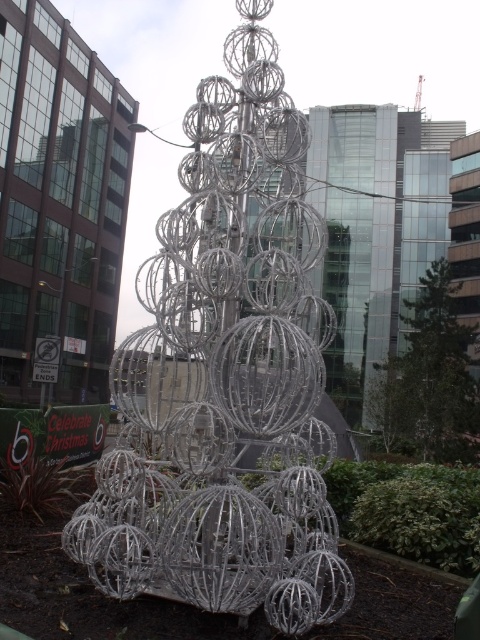
You are standing in the public space where the sculpture is located. There is a point marked at coordinates [226,374]. Which object does this point correspond to?

The point at [226,374] corresponds to the metallic wire sculpture at center.

You are standing in the plaza and want to take a photo of both the metallic wire sculpture at center and the clear glass tree at center. Which object should you position closer to the camera to ensure both are in focus?

To ensure both the metallic wire sculpture at center and the clear glass tree at center are in focus, you should position the metallic wire sculpture at center closer to the camera since it is farther away from the clear glass tree at center by 17.06 meters.

In the scene shown: You are an urban planner assessing the space around the metallic wire sculpture at center and the clear glass tree at center. Which object takes up more horizontal space in the plaza?

The clear glass tree at center has a greater width than the metallic wire sculpture at center, so it occupies more horizontal space in the plaza.